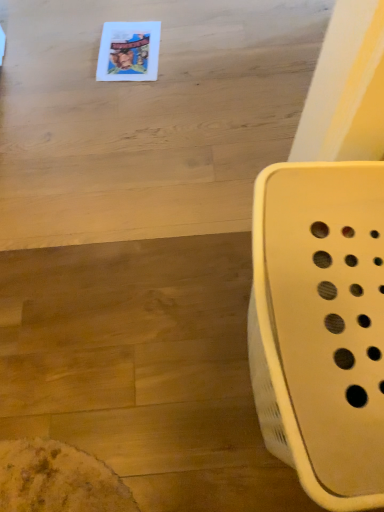
Question: Considering the positions of matte wood table at upper center and white plastic laundry basket at right in the image, is matte wood table at upper center taller or shorter than white plastic laundry basket at right?

Choices:
 (A) tall
 (B) short

Answer: (B)

Question: Would you say matte wood table at upper center is inside or outside white plastic laundry basket at right?

Choices:
 (A) inside
 (B) outside

Answer: (B)

Question: From a real-world perspective, is matte wood table at upper center above or below white plastic laundry basket at right?

Choices:
 (A) above
 (B) below

Answer: (B)

Question: Considering their positions, is white plastic laundry basket at right located in front of or behind matte wood table at upper center?

Choices:
 (A) behind
 (B) front

Answer: (B)

Question: From a real-world perspective, is white plastic laundry basket at right positioned above or below matte wood table at upper center?

Choices:
 (A) above
 (B) below

Answer: (A)

Question: Considering the positions of white plastic laundry basket at right and matte wood table at upper center in the image, is white plastic laundry basket at right wider or thinner than matte wood table at upper center?

Choices:
 (A) thin
 (B) wide

Answer: (A)

Question: Looking at the image, does white plastic laundry basket at right seem bigger or smaller compared to matte wood table at upper center?

Choices:
 (A) small
 (B) big

Answer: (B)